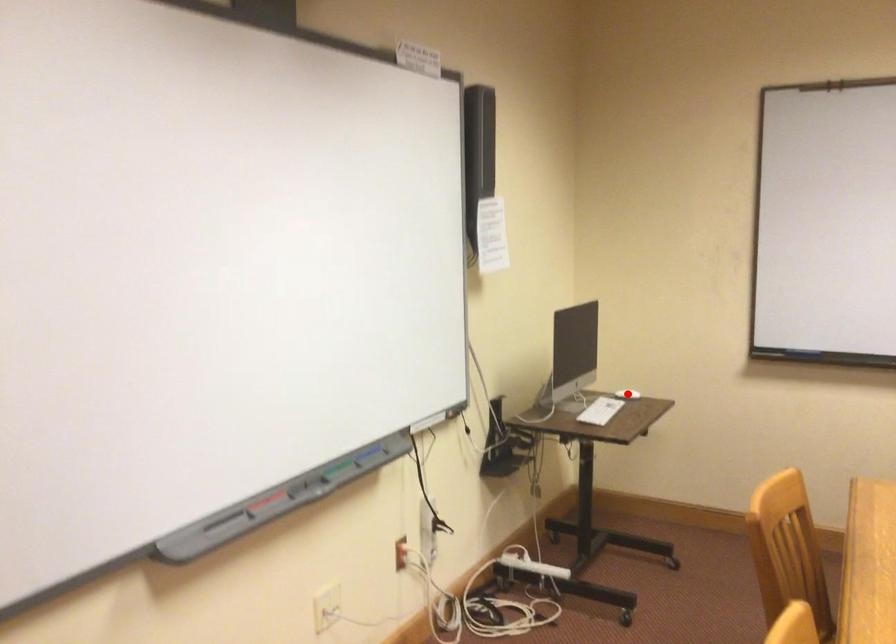
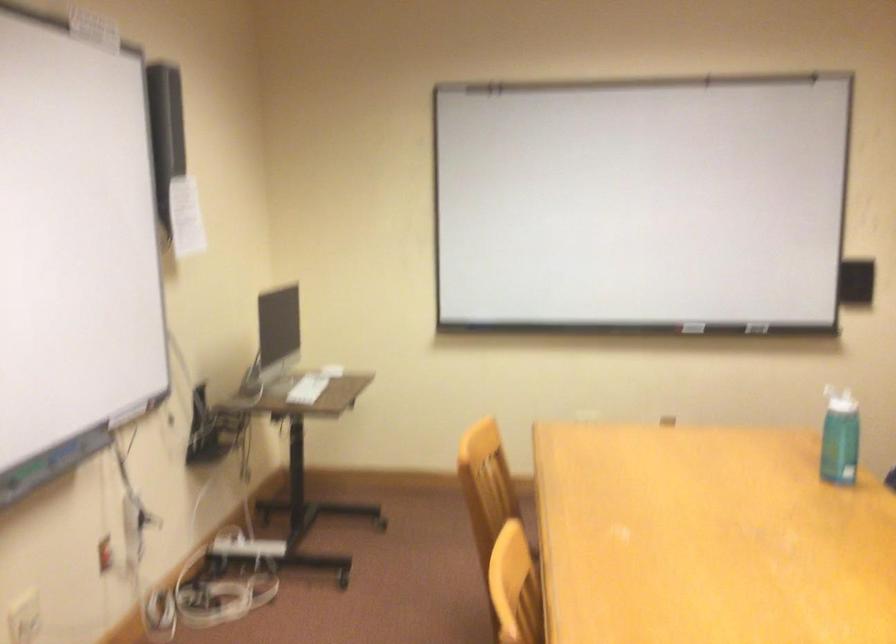
Question: I am providing you with two images of the same scene from different viewpoints. A red point is marked on the first image. At the location where the point appears in image 1, is it still visible in image 2?

Choices:
 (A) Yes
 (B) No

Answer: (B)